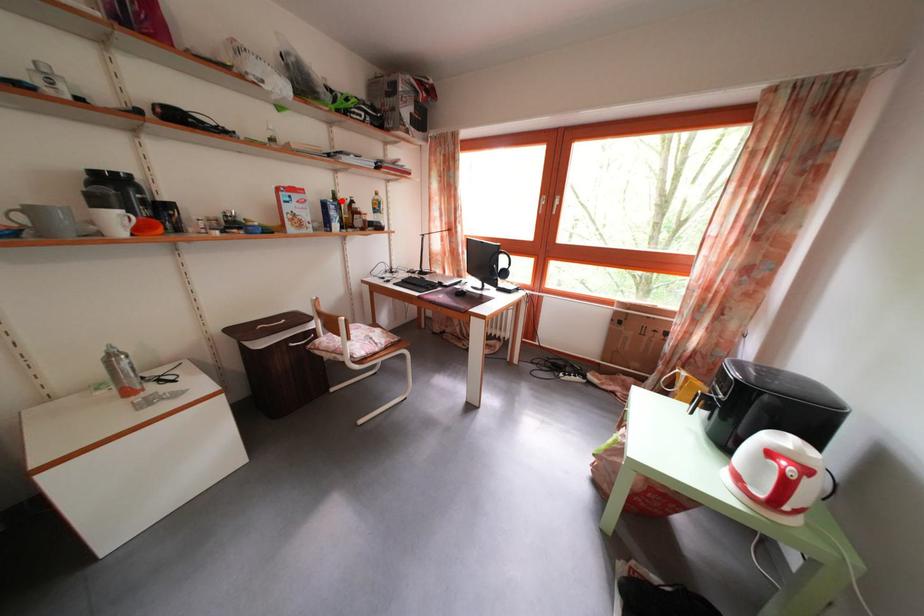
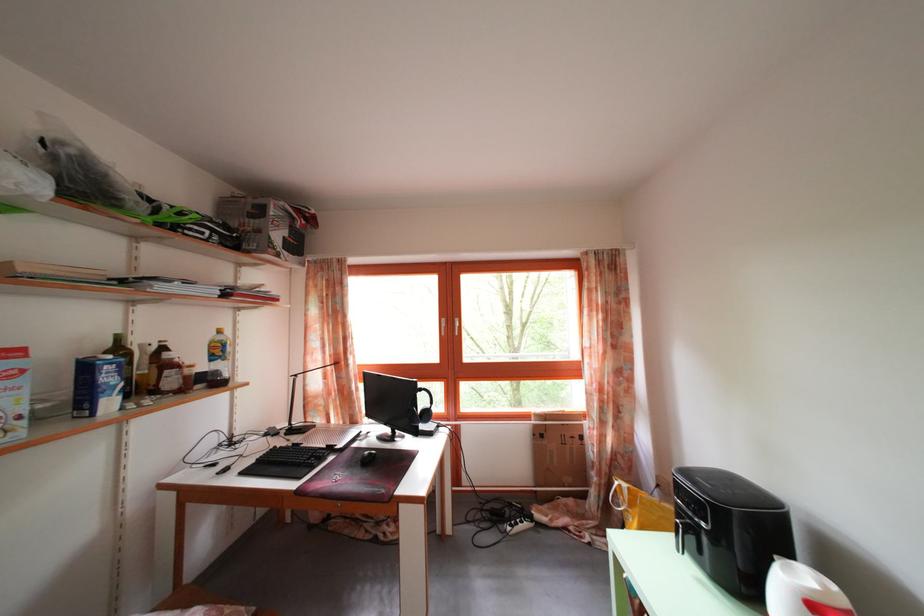
Where in the second image is the point corresponding to the highlighted location from the first image?

(126, 346)